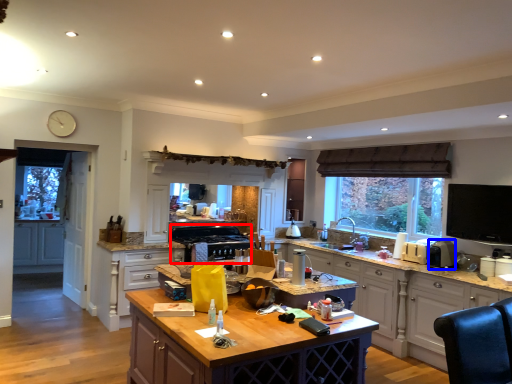
Question: Which object appears farthest to the camera in this image, appliance (highlighted by a red box) or appliance (highlighted by a blue box)?

Choices:
 (A) appliance
 (B) appliance

Answer: (A)